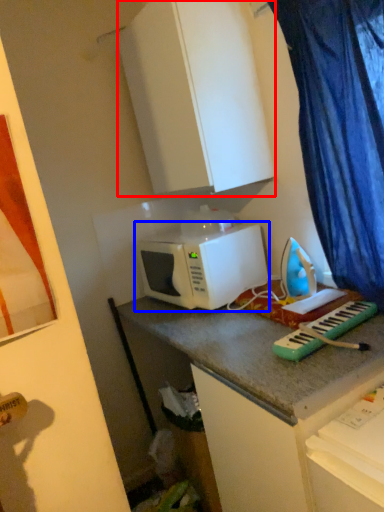
Question: Which object is closer to the camera taking this photo, cabinetry (highlighted by a red box) or microwave oven (highlighted by a blue box)?

Choices:
 (A) cabinetry
 (B) microwave oven

Answer: (A)